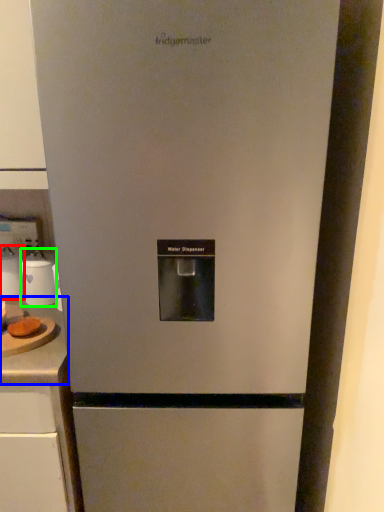
Question: Which is nearer to the appliance (highlighted by a red box)? counter top (highlighted by a blue box) or appliance (highlighted by a green box).

Choices:
 (A) counter top
 (B) appliance

Answer: (B)